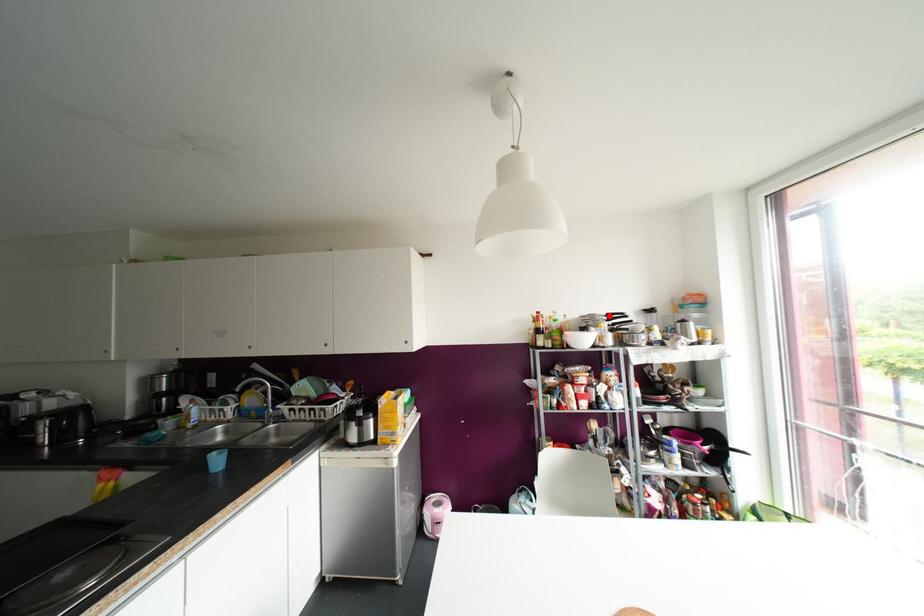
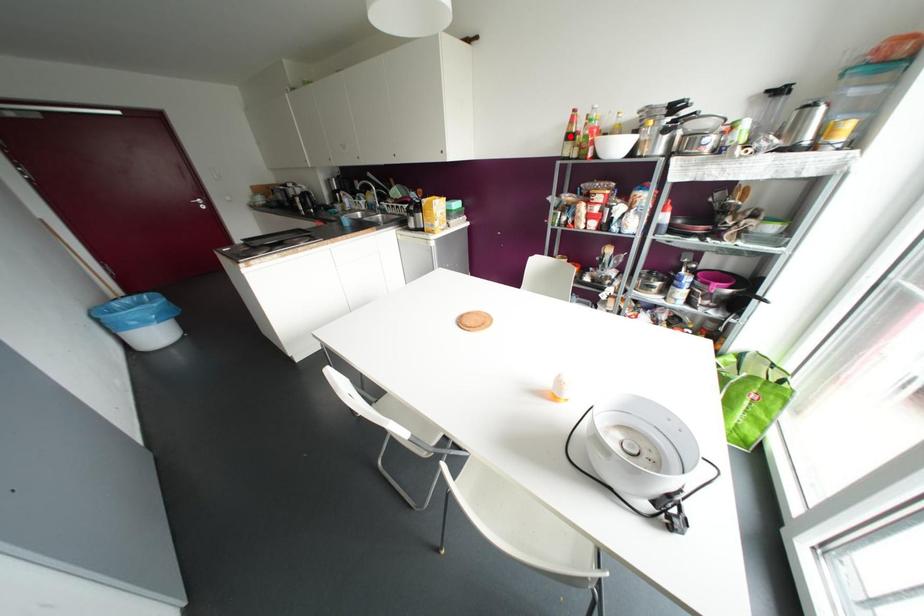
I am providing you with two images of the same scene from different viewpoints. A red point is marked on the first image and another point is marked on the second image. Are the points marked in image1 and image2 representing the same 3D position?

No